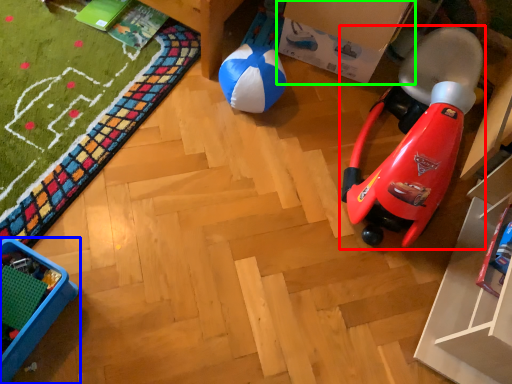
Question: Which object is positioned farthest from toy (highlighted by a red box)? Select from furniture (highlighted by a blue box) and cardboard box (highlighted by a green box).

Choices:
 (A) furniture
 (B) cardboard box

Answer: (A)